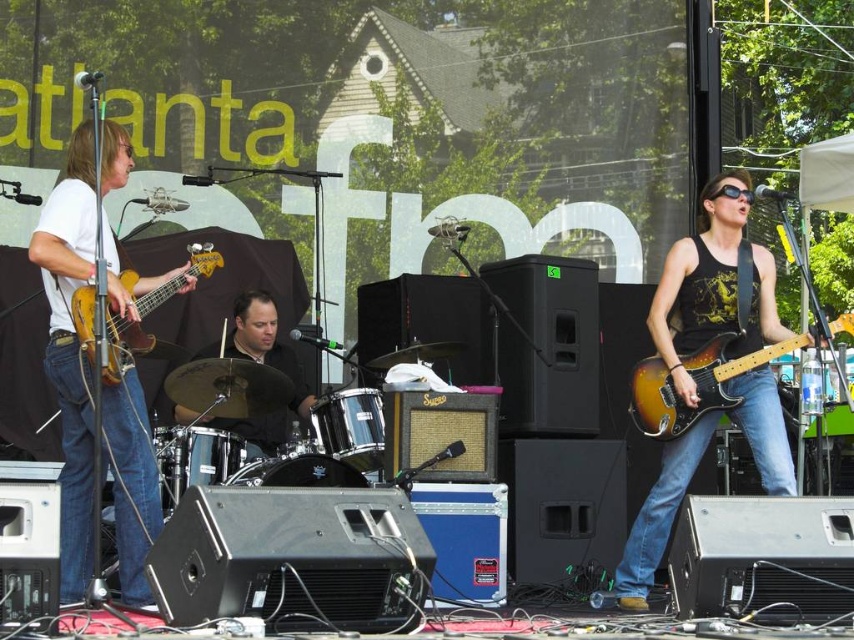
Who is positioned more to the right, satin black guitar at center or black leather drum set at center?

From the viewer's perspective, satin black guitar at center appears more on the right side.

Who is more forward, (794, 492) or (212, 349)?

Point (794, 492) is more forward.

Is point (670, 260) behind point (243, 353)?

No, (670, 260) is in front of (243, 353).

At what (x,y) coordinates should I click in order to perform the action: click on satin black guitar at center. Please return your answer as a coordinate pair (x, y). The width and height of the screenshot is (854, 640). Looking at the image, I should click on (714, 289).

Is matte brown guitar at left taller than black leather drum set at center?

Indeed, matte brown guitar at left has a greater height compared to black leather drum set at center.

Is matte brown guitar at left positioned behind black leather drum set at center?

No, it is in front of black leather drum set at center.

Is point (69, 348) positioned behind point (279, 435)?

No, (69, 348) is in front of (279, 435).

Identify the location of matte brown guitar at left. (69, 349).

Can you confirm if satin black guitar at center is positioned above sunburst wood electric guitar at right?

No, satin black guitar at center is not above sunburst wood electric guitar at right.

Between satin black guitar at center and sunburst wood electric guitar at right, which one appears on the left side from the viewer's perspective?

satin black guitar at center

At what (x,y) coordinates should I click in order to perform the action: click on satin black guitar at center. Please return your answer as a coordinate pair (x, y). Looking at the image, I should click on (714, 289).